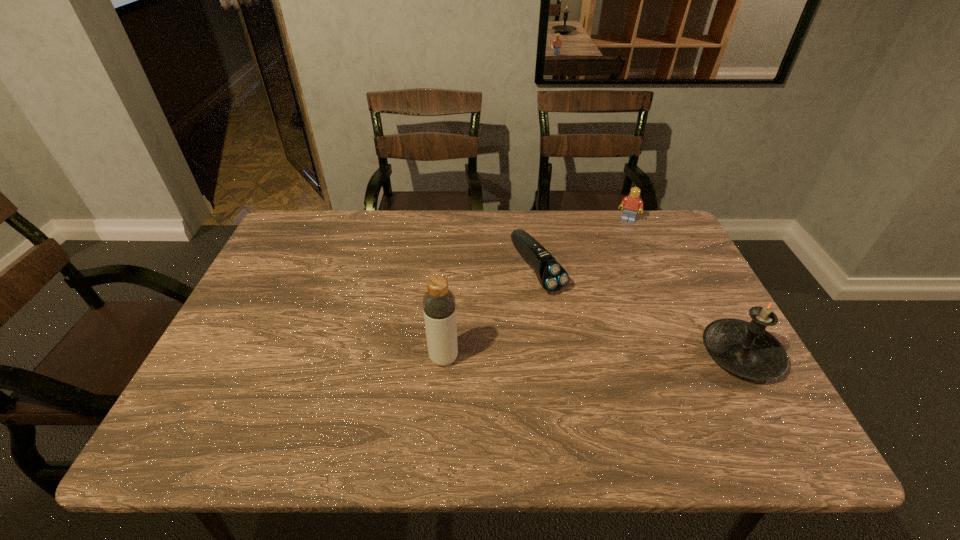
Identify the location of free space that satisfies the following two spatial constraints: 1. on the back side of the leftmost object; 2. on the right side of the farthest object. (454, 220).

The width and height of the screenshot is (960, 540). What are the coordinates of `free spot that satisfies the following two spatial constraints: 1. on the back side of the second shortest object; 2. on the right side of the electric shaver` in the screenshot? It's located at click(x=531, y=220).

The width and height of the screenshot is (960, 540). In order to click on vacant space that satisfies the following two spatial constraints: 1. on the back side of the third tallest object; 2. on the right side of the electric shaver in this screenshot , I will do `click(531, 220)`.